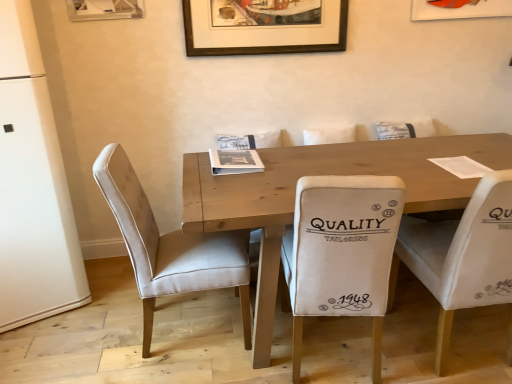
Identify the location of free space in front of beige velvet chair at left, positioned as the 3th chair in right-to-left order. This screenshot has width=512, height=384. (185, 368).